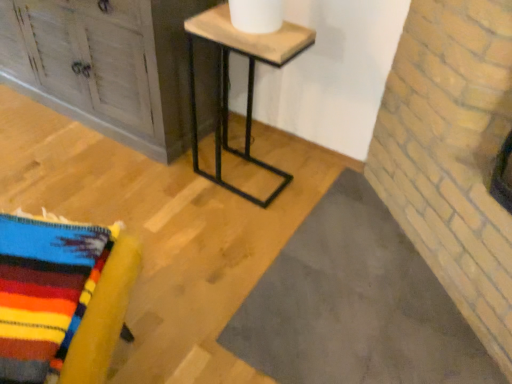
The image size is (512, 384). Identify the location of vacant position to the left of wooden/marble table at center. (166, 175).